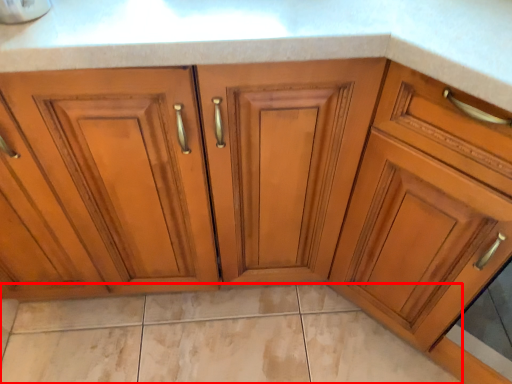
Question: Considering the relative positions of granite (annotated by the red box) and cabinetry in the image provided, where is granite (annotated by the red box) located with respect to the staircase?

Choices:
 (A) right
 (B) left

Answer: (B)